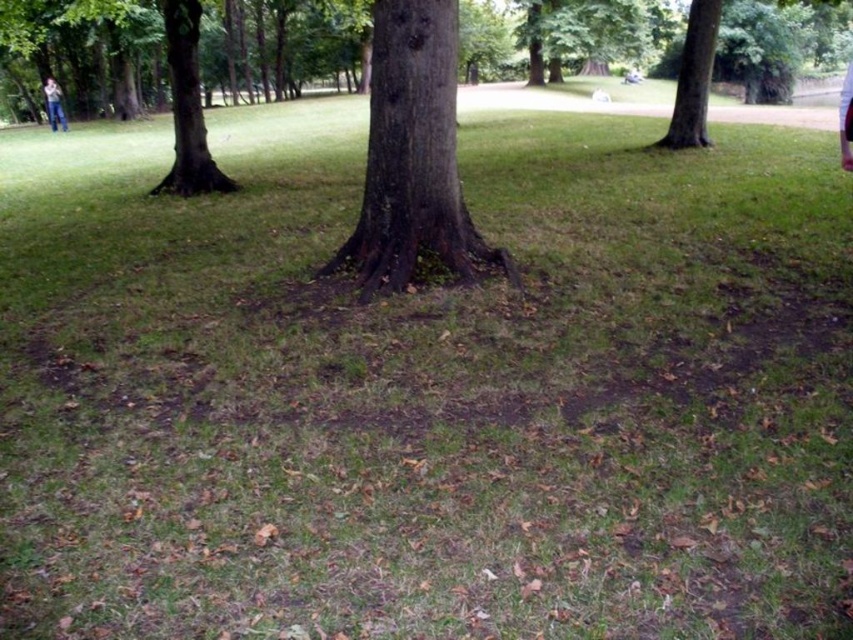
Question: Estimate the real-world distances between objects in this image. Which object is farther from the dark brown bark tree at center?

Choices:
 (A) brown rough bark tree at left
 (B) smooth bark tree at upper right
 (C) jeans-clad person at upper left

Answer: (C)

Question: Can you confirm if brown rough bark tree at left is positioned below jeans-clad person at upper left?

Choices:
 (A) no
 (B) yes

Answer: (B)

Question: Which object is the farthest from the smooth bark tree at upper right?

Choices:
 (A) brown rough bark tree at left
 (B) jeans-clad person at upper left

Answer: (B)

Question: From the image, what is the correct spatial relationship of dark brown bark tree at center in relation to jeans-clad person at upper left?

Choices:
 (A) below
 (B) above

Answer: (A)

Question: Is smooth bark tree at upper right above jeans-clad person at upper left?

Choices:
 (A) no
 (B) yes

Answer: (B)

Question: Which is nearer to the smooth bark tree at upper right?

Choices:
 (A) brown rough bark tree at left
 (B) jeans-clad person at upper left

Answer: (A)